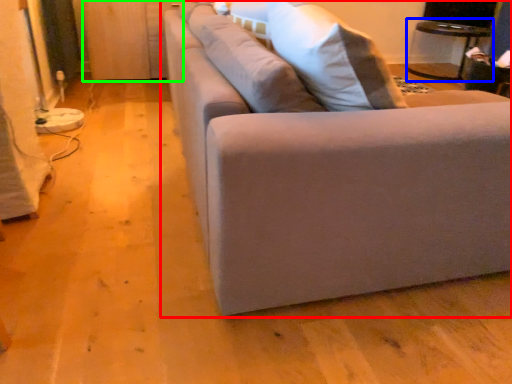
Question: Which object is the farthest from studio couch (highlighted by a red box)? Choose among these: table (highlighted by a blue box) or dresser (highlighted by a green box).

Choices:
 (A) table
 (B) dresser

Answer: (A)